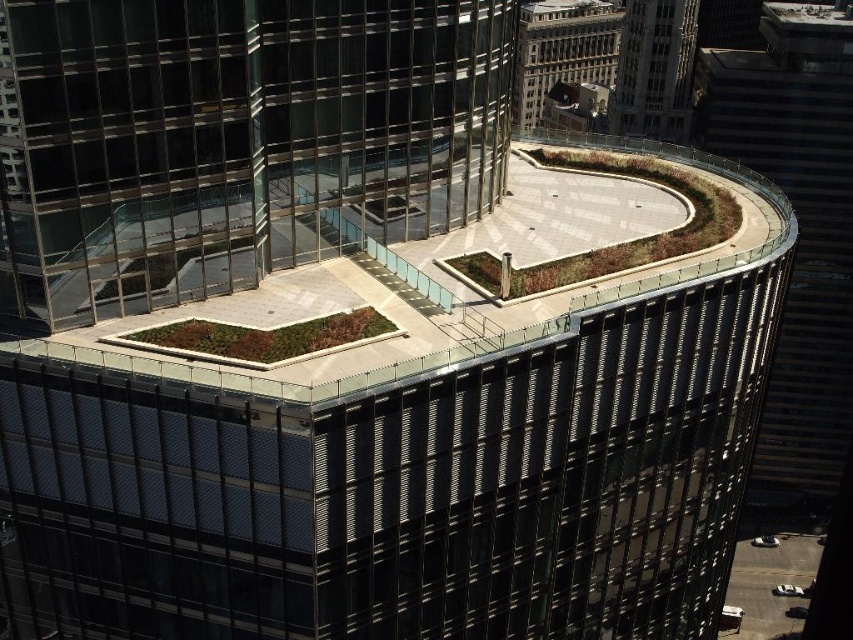
Question: Among these objects, which one is nearest to the camera?

Choices:
 (A) glassy steel skyscraper at upper right
 (B) metallic glass tower at right

Answer: (B)

Question: Is transparent glass building at upper center bigger than glassy steel skyscraper at upper right?

Choices:
 (A) no
 (B) yes

Answer: (A)

Question: Does transparent glass building at upper center have a smaller size compared to glassy steel skyscraper at upper right?

Choices:
 (A) yes
 (B) no

Answer: (A)

Question: Among these points, which one is farthest from the camera?

Choices:
 (A) (654, 13)
 (B) (561, 51)
 (C) (222, 83)
 (D) (796, 461)

Answer: (B)

Question: Is transparent glass building at upper center behind metallic glass tower at right?

Choices:
 (A) no
 (B) yes

Answer: (A)

Question: Which object is positioned closest to the matte glass tower at upper center?

Choices:
 (A) transparent glass building at upper center
 (B) glassy steel skyscraper at upper right
 (C) metallic glass tower at right

Answer: (C)